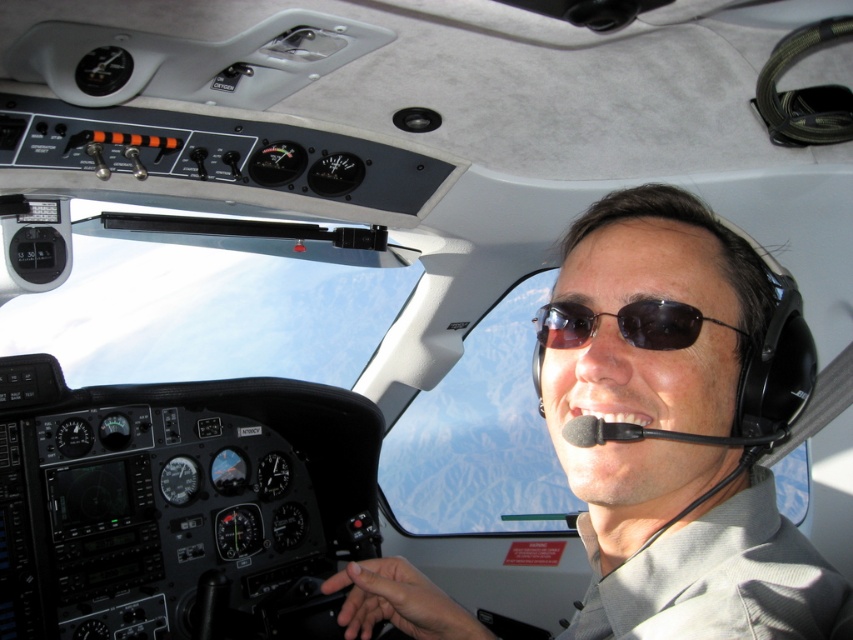
Question: Is sunglasses at center smaller than black matte sunglasses at center?

Choices:
 (A) no
 (B) yes

Answer: (A)

Question: Among these points, which one is nearest to the camera?

Choices:
 (A) (688, 323)
 (B) (595, 266)

Answer: (A)

Question: Is sunglasses at center closer to camera compared to black matte sunglasses at center?

Choices:
 (A) no
 (B) yes

Answer: (B)

Question: Does sunglasses at center appear under black matte sunglasses at center?

Choices:
 (A) yes
 (B) no

Answer: (A)

Question: Which point appears closest to the camera in this image?

Choices:
 (A) (712, 429)
 (B) (701, 321)

Answer: (B)